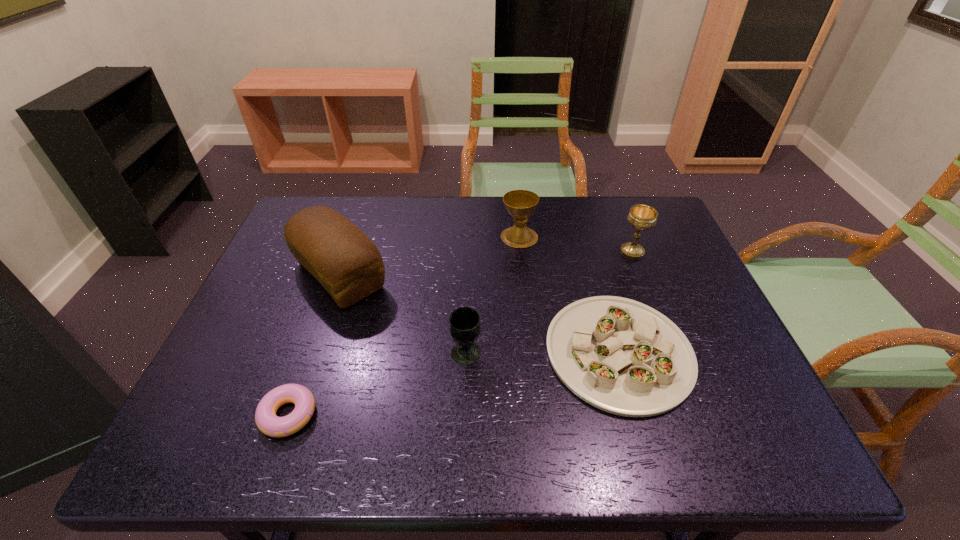
Locate an element on the screen. Image resolution: width=960 pixels, height=540 pixels. object that is at the near left corner is located at coordinates (268, 423).

I want to click on object that is at the near right corner, so click(x=621, y=356).

In the image, there is a desktop. In order to click on vacant space at the far edge in this screenshot , I will do [x=580, y=201].

In the image, there is a desktop. Find the location of `free space at the near edge`. free space at the near edge is located at coordinates (340, 458).

Image resolution: width=960 pixels, height=540 pixels. I want to click on blank space at the left edge of the desktop, so click(x=300, y=318).

This screenshot has height=540, width=960. Identify the location of free region at the right edge. (669, 288).

Where is `vacant space at the far left corner`? This screenshot has width=960, height=540. vacant space at the far left corner is located at coordinates point(349,195).

Identify the location of free space at the far right corner of the desktop. (659, 213).

Find the location of a particular element. This screenshot has height=540, width=960. free point at the near right corner is located at coordinates (708, 430).

Locate an element on the screen. free point between the nearest chalice and the second chalice from right to left is located at coordinates (492, 295).